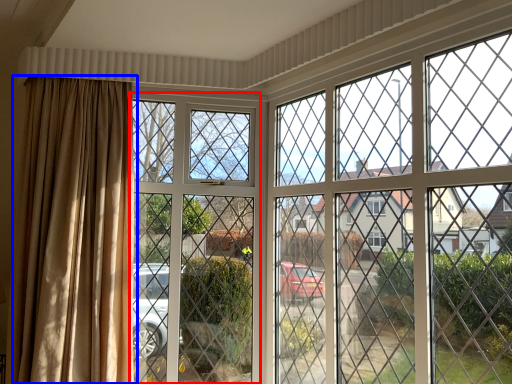
Question: Which object appears closest to the camera in this image, screen door (highlighted by a red box) or curtain (highlighted by a blue box)?

Choices:
 (A) screen door
 (B) curtain

Answer: (B)